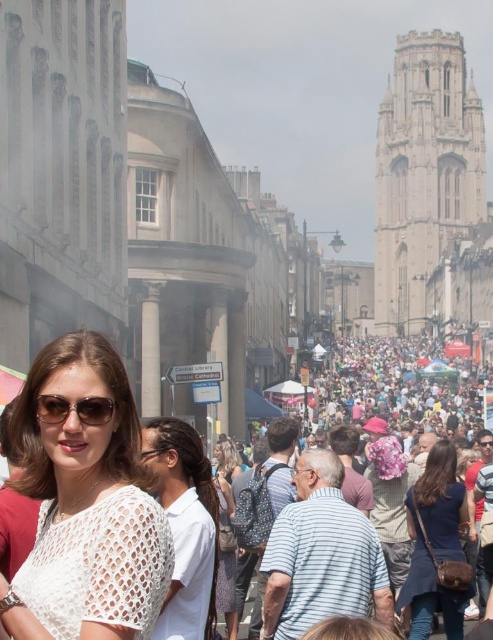
Which of these two, white crochet top at center or patterned fabric dress at center, stands taller?

Standing taller between the two is white crochet top at center.

Who is more forward, (x=157, y=467) or (x=222, y=602)?

Point (x=157, y=467)

I want to click on white crochet top at center, so pyautogui.click(x=184, y=525).

Does patterned fabric dress at center have a smaller size compared to sunglasses at center?

No, patterned fabric dress at center is not smaller than sunglasses at center.

Describe the element at coordinates (226, 534) in the screenshot. The image size is (493, 640). I see `patterned fabric dress at center` at that location.

Locate an element on the screen. The height and width of the screenshot is (640, 493). patterned fabric dress at center is located at coordinates (226, 534).

Who is shorter, white crochet top at center or dark blue fabric dress at lower right?

white crochet top at center is shorter.

Who is more forward, [171,444] or [461,490]?

Point [171,444] is in front.

At what (x,y) coordinates should I click in order to perform the action: click on white crochet top at center. Please return your answer as a coordinate pair (x, y). Looking at the image, I should click on (184, 525).